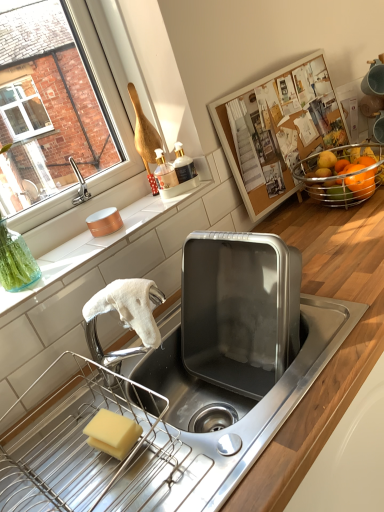
Identify the location of shiny orange fruit at upper right. click(346, 174).

This screenshot has height=512, width=384. Find the location of `white matte towel at left, which is the 1th countertop in top-to-bottom order`. white matte towel at left, which is the 1th countertop in top-to-bottom order is located at coordinates (85, 234).

In order to face orange matte at right, should I rotate leftwards or rightwards?

You should rotate right by 21.574 degrees.

Image resolution: width=384 pixels, height=512 pixels. Find the location of `yellow sponge at lower left`. yellow sponge at lower left is located at coordinates (112, 433).

From the image's perspective, is yellow sponge at lower left located above or below shiny orange fruit at upper right?

Based on their image positions, yellow sponge at lower left is located beneath shiny orange fruit at upper right.

Between yellow sponge at lower left and shiny orange fruit at upper right, which one has smaller width?

yellow sponge at lower left is thinner.

Would you say yellow sponge at lower left is a long distance from shiny orange fruit at upper right?

Yes, yellow sponge at lower left and shiny orange fruit at upper right are quite far apart.

Which is more to the left, yellow sponge at lower left or shiny orange fruit at upper right?

yellow sponge at lower left is more to the left.

Looking at this image, considering the sizes of objects yellow sponge at lower left and wooden at lower right, the 1th countertop positioned from the bottom, in the image provided, who is thinner, yellow sponge at lower left or wooden at lower right, the 1th countertop positioned from the bottom,?

yellow sponge at lower left.

From a real-world perspective, which is physically below, yellow sponge at lower left or wooden at lower right, the 2th countertop positioned from the top?

wooden at lower right, the 2th countertop positioned from the top, is physically lower.

Between yellow sponge at lower left and wooden at lower right, the 1th countertop positioned from the bottom, which one has more height?

wooden at lower right, the 1th countertop positioned from the bottom, is taller.

From the image's perspective, which is below, orange matte at right or shiny orange fruit at upper right?

From the image's view, orange matte at right is below.

Measure the distance from orange matte at right to shiny orange fruit at upper right.

orange matte at right is 2.48 inches from shiny orange fruit at upper right.

You are a GUI agent. You are given a task and a screenshot of the screen. Output one action in this format:
    pyautogui.click(x=<x>, y=<y>)
    Task: Click on the orange in front of the shiny orange fruit at upper right
    
    Given the screenshot: What is the action you would take?
    pyautogui.click(x=361, y=184)

From the picture: Between orange matte at right and shiny orange fruit at upper right, which one has smaller width?

With smaller width is orange matte at right.

Is white matte towel at left, which is counted as the 2th countertop, starting from the bottom, shorter than orange matte at right?

Correct, white matte towel at left, which is counted as the 2th countertop, starting from the bottom, is not as tall as orange matte at right.

Consider the image. Is white matte towel at left, which is counted as the 2th countertop, starting from the bottom, surrounding orange matte at right?

No, orange matte at right is not surrounded by white matte towel at left, which is counted as the 2th countertop, starting from the bottom.

Which object is positioned more to the left, white matte towel at left, which is counted as the 2th countertop, starting from the bottom, or orange matte at right?

Positioned to the left is white matte towel at left, which is counted as the 2th countertop, starting from the bottom.

Is wooden at lower right, the 1th countertop positioned from the bottom, completely or partially outside of shiny orange fruit at upper right?

Indeed, wooden at lower right, the 1th countertop positioned from the bottom, is completely outside shiny orange fruit at upper right.

Does wooden at lower right, the 2th countertop positioned from the top, turn towards shiny orange fruit at upper right?

No, wooden at lower right, the 2th countertop positioned from the top, is not turned towards shiny orange fruit at upper right.

From the image's perspective, is wooden at lower right, the 2th countertop positioned from the top, located above or below shiny orange fruit at upper right?

Clearly, from the image's perspective, wooden at lower right, the 2th countertop positioned from the top, is below shiny orange fruit at upper right.

Can you tell me how much wooden at lower right, the 1th countertop positioned from the bottom, and shiny orange fruit at upper right differ in facing direction?

1.7 degrees.

From a real-world perspective, does wooden at lower right, the 1th countertop positioned from the bottom, stand above yellow sponge at lower left?

No, from a real-world perspective, wooden at lower right, the 1th countertop positioned from the bottom, is not over yellow sponge at lower left

In the image, is wooden at lower right, the 1th countertop positioned from the bottom, positioned in front of or behind yellow sponge at lower left?

wooden at lower right, the 1th countertop positioned from the bottom, is in front of yellow sponge at lower left.

From the image's perspective, which object appears higher, wooden at lower right, the 1th countertop positioned from the bottom, or yellow sponge at lower left?

wooden at lower right, the 1th countertop positioned from the bottom.

Considering the sizes of wooden at lower right, the 1th countertop positioned from the bottom, and yellow sponge at lower left in the image, is wooden at lower right, the 1th countertop positioned from the bottom, taller or shorter than yellow sponge at lower left?

wooden at lower right, the 1th countertop positioned from the bottom, is taller than yellow sponge at lower left.

From the image's perspective, which one is positioned lower, shiny orange fruit at upper right or orange matte at right?

From the image's view, orange matte at right is below.

From a real-world perspective, is shiny orange fruit at upper right positioned above or below orange matte at right?

shiny orange fruit at upper right is below orange matte at right.

Considering the sizes of shiny orange fruit at upper right and orange matte at right in the image, is shiny orange fruit at upper right wider or thinner than orange matte at right?

Answer: Clearly, shiny orange fruit at upper right has more width compared to orange matte at right.

Who is taller, shiny orange fruit at upper right or orange matte at right?

shiny orange fruit at upper right.

Find the location of a particular element. The width and height of the screenshot is (384, 512). soap in front of the shiny orange fruit at upper right is located at coordinates [112, 433].

Identify the location of soap that is behind the wooden at lower right, the 1th countertop positioned from the bottom. Image resolution: width=384 pixels, height=512 pixels. (112, 433).

From the image, which object appears to be nearer to white matte towel at left, which is the 1th countertop in top-to-bottom order, yellow sponge at lower left or shiny orange fruit at upper right?

yellow sponge at lower left lies closer to white matte towel at left, which is the 1th countertop in top-to-bottom order, than the other object.

Looking at the image, which one is located further to shiny orange fruit at upper right, orange matte at right or white matte towel at left, which is counted as the 2th countertop, starting from the bottom?

Among the two, white matte towel at left, which is counted as the 2th countertop, starting from the bottom, is located further to shiny orange fruit at upper right.

From the image, which object appears to be farther from shiny orange fruit at upper right, wooden at lower right, the 1th countertop positioned from the bottom, or orange matte at right?

Based on the image, wooden at lower right, the 1th countertop positioned from the bottom, appears to be further to shiny orange fruit at upper right.

From the image, which object appears to be nearer to shiny orange fruit at upper right, yellow sponge at lower left or wooden at lower right, the 1th countertop positioned from the bottom?

Among the two, wooden at lower right, the 1th countertop positioned from the bottom, is located nearer to shiny orange fruit at upper right.

Considering their positions, is yellow sponge at lower left positioned closer to white matte towel at left, which is the 1th countertop in top-to-bottom order, than wooden at lower right, the 1th countertop positioned from the bottom?

wooden at lower right, the 1th countertop positioned from the bottom, is closer to white matte towel at left, which is the 1th countertop in top-to-bottom order.

Which object lies further to the anchor point wooden at lower right, the 2th countertop positioned from the top, white matte towel at left, which is counted as the 2th countertop, starting from the bottom, or shiny orange fruit at upper right?

shiny orange fruit at upper right.

Which object lies further to the anchor point wooden at lower right, the 2th countertop positioned from the top, shiny orange fruit at upper right or white matte towel at left, which is the 1th countertop in top-to-bottom order?

shiny orange fruit at upper right.

Considering their positions, is yellow sponge at lower left positioned further to orange matte at right than wooden at lower right, the 2th countertop positioned from the top?

yellow sponge at lower left lies further to orange matte at right than the other object.

Image resolution: width=384 pixels, height=512 pixels. I want to click on orange situated between yellow sponge at lower left and shiny orange fruit at upper right from left to right, so click(x=361, y=184).

I want to click on soap between wooden at lower right, the 1th countertop positioned from the bottom, and white matte towel at left, which is counted as the 2th countertop, starting from the bottom, from front to back, so click(x=112, y=433).

At what (x,y) coordinates should I click in order to perform the action: click on soap between white matte towel at left, which is counted as the 2th countertop, starting from the bottom, and orange matte at right. Please return your answer as a coordinate pair (x, y). The height and width of the screenshot is (512, 384). Looking at the image, I should click on (112, 433).

Where is `soap located between wooden at lower right, the 2th countertop positioned from the top, and shiny orange fruit at upper right in the depth direction`? The image size is (384, 512). soap located between wooden at lower right, the 2th countertop positioned from the top, and shiny orange fruit at upper right in the depth direction is located at coordinates (112, 433).